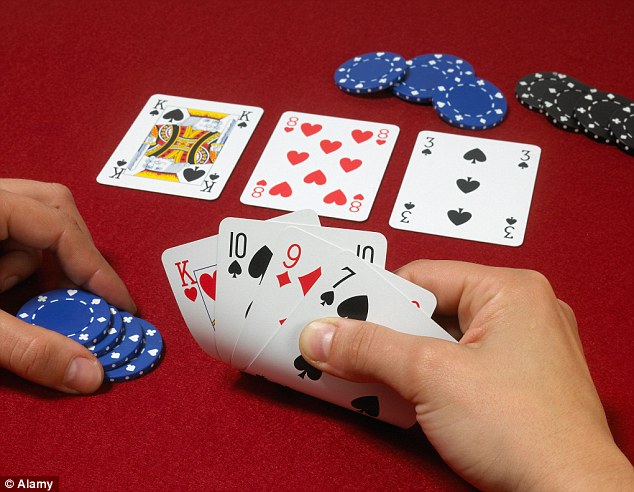
The image size is (634, 492). I want to click on tabletop, so click(134, 437).